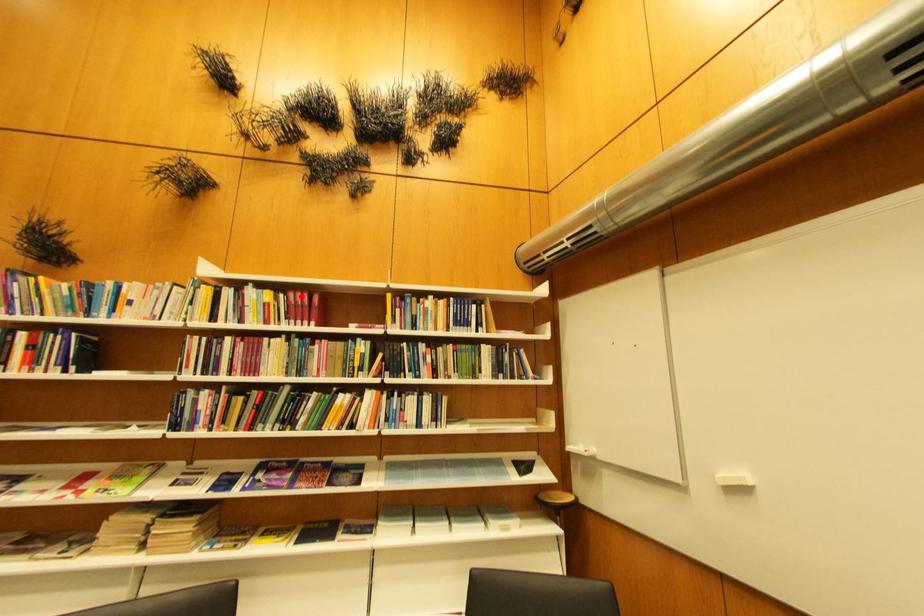
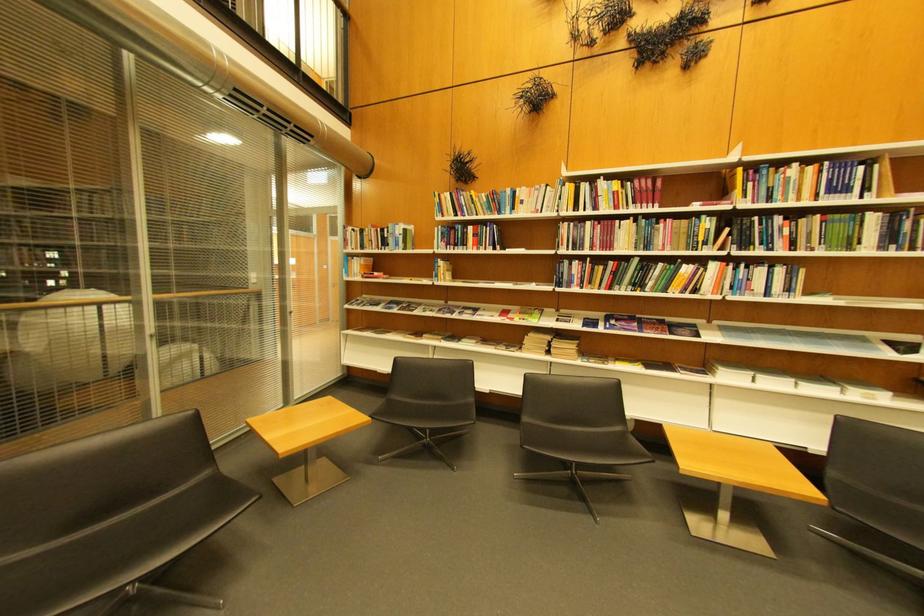
Locate, in the second image, the point that corresponds to the highlighted location in the first image.

(648, 183)